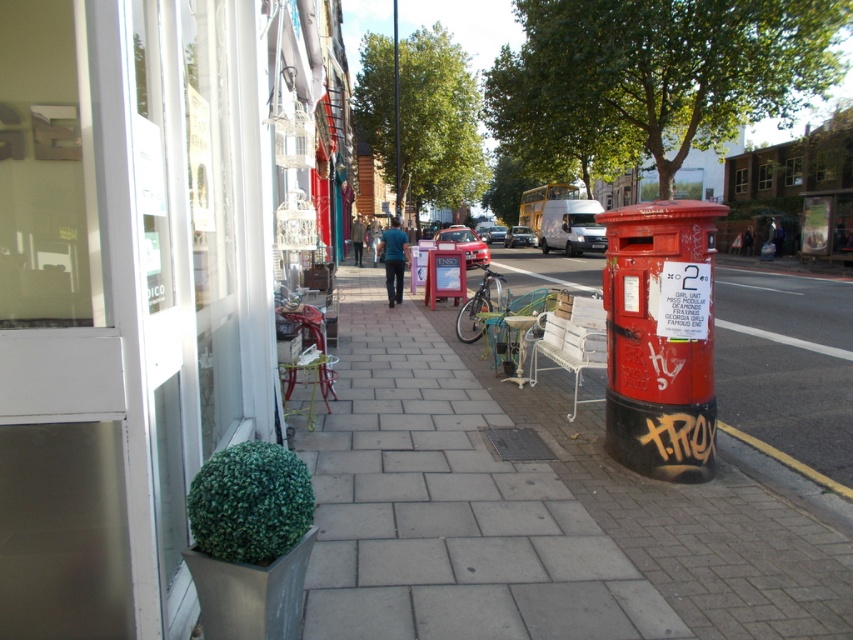
Does green matte plant at lower left have a larger size compared to yellow rubber at lower right?

Indeed, green matte plant at lower left has a larger size compared to yellow rubber at lower right.

Who is more distant from viewer, (x=35, y=106) or (x=796, y=484)?

Point (x=796, y=484)

Describe the element at coordinates (148, 278) in the screenshot. I see `green matte plant at lower left` at that location.

Locate an element on the screen. green matte plant at lower left is located at coordinates (148, 278).